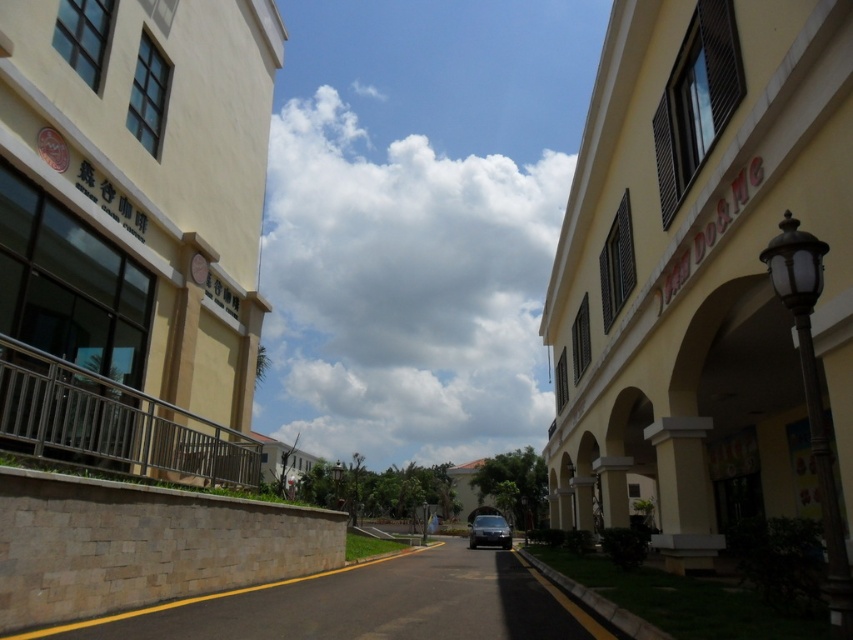
Question: Among these points, which one is farthest from the camera?

Choices:
 (A) (122, 342)
 (B) (281, 582)
 (C) (679, 538)

Answer: (A)

Question: Observing the image, what is the correct spatial positioning of beige stucco building at left in reference to black asphalt road at center?

Choices:
 (A) right
 (B) left

Answer: (B)

Question: Does yellow matte building at right have a lesser width compared to black asphalt road at center?

Choices:
 (A) no
 (B) yes

Answer: (A)

Question: Does yellow matte building at right have a smaller size compared to beige stucco building at left?

Choices:
 (A) yes
 (B) no

Answer: (B)

Question: Among these points, which one is nearest to the camera?

Choices:
 (A) (566, 444)
 (B) (364, 563)
 (C) (173, 60)
 (D) (508, 531)

Answer: (C)

Question: Which point appears farthest from the camera in this image?

Choices:
 (A) tap(488, 538)
 (B) tap(729, 148)
 (C) tap(521, 611)

Answer: (A)